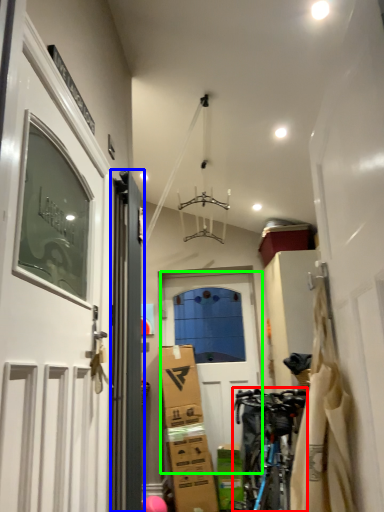
Question: Which object is positioned closest to bicycle (highlighted by a red box)? Select from door (highlighted by a blue box) and door (highlighted by a green box).

Choices:
 (A) door
 (B) door

Answer: (B)